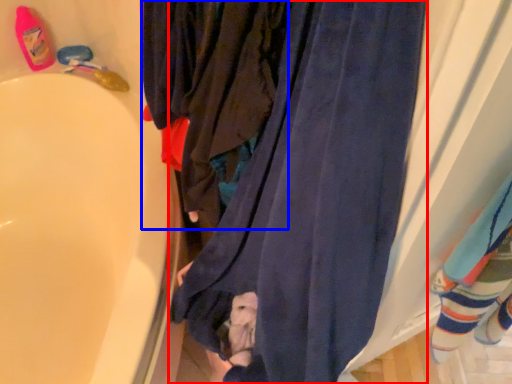
Question: Which of the following is the farthest to the observer, curtain (highlighted by a red box) or clothing (highlighted by a blue box)?

Choices:
 (A) curtain
 (B) clothing

Answer: (B)